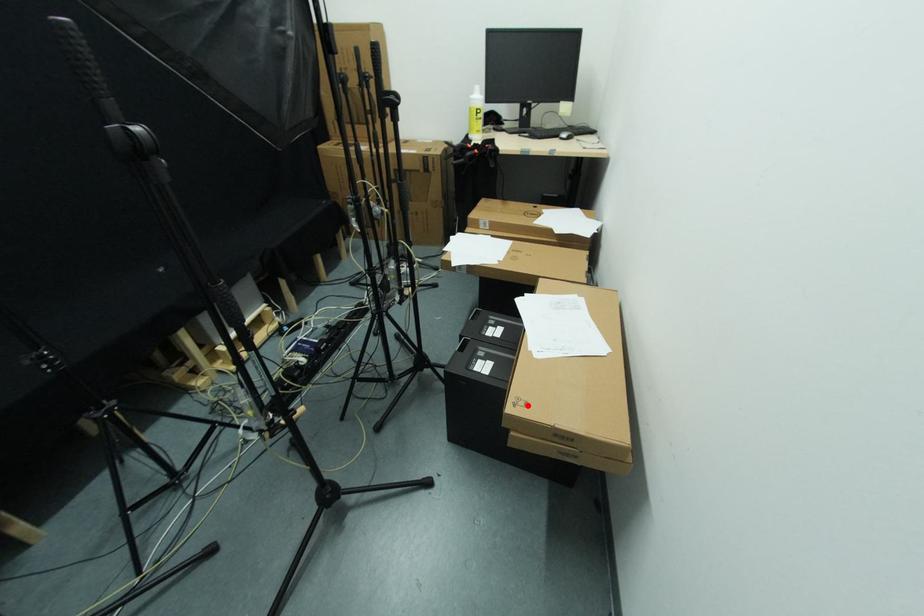
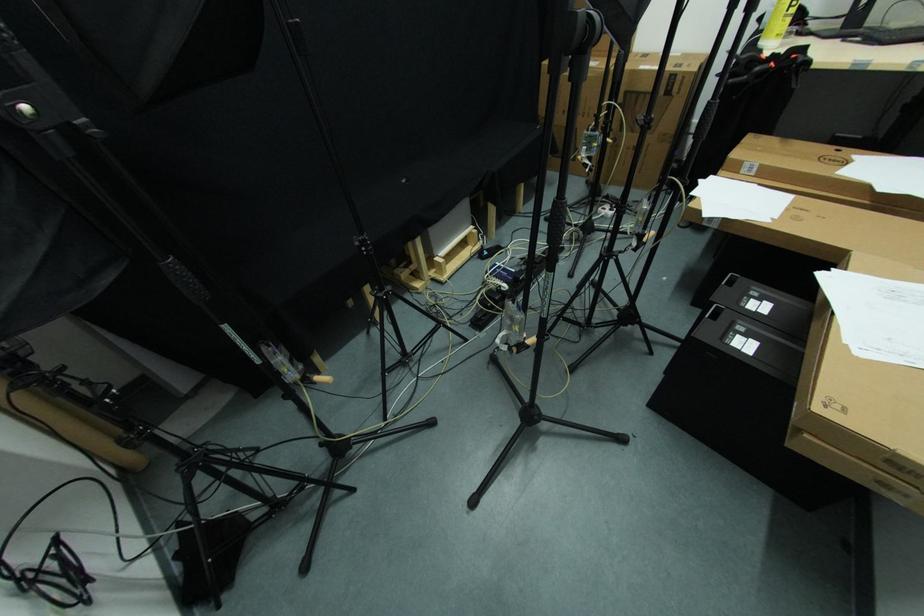
Find the pixel in the second image that matches the highlighted location in the first image.

(848, 413)